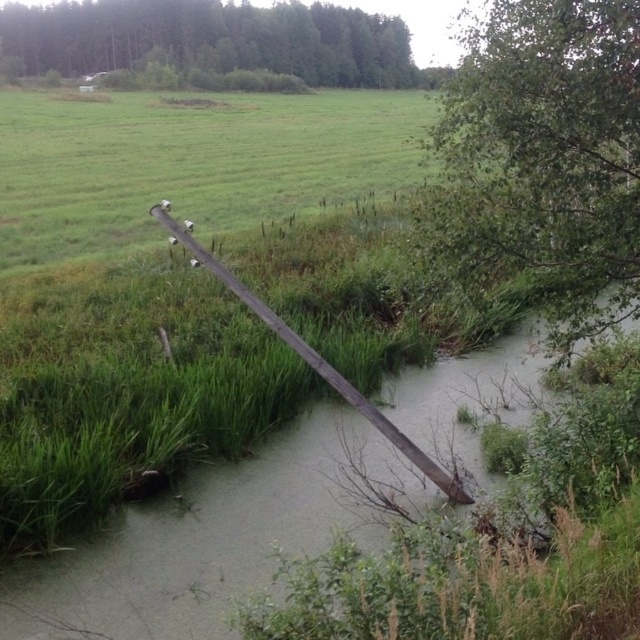
Which of these two, green leafy tree at lower right or green leafy tree at upper center, stands shorter?

Standing shorter between the two is green leafy tree at lower right.

Is point (609, 308) closer to viewer compared to point (426, 74)?

That is True.

Does point (493, 227) come closer to viewer compared to point (401, 56)?

Yes.

At what (x,y) coordinates should I click in order to perform the action: click on green leafy tree at lower right. Please return your answer as a coordinate pair (x, y). This screenshot has height=640, width=640. Looking at the image, I should click on (545, 157).

Is green leafy tree at lower right to the right of wooden pole at center from the viewer's perspective?

Correct, you'll find green leafy tree at lower right to the right of wooden pole at center.

Does green leafy tree at lower right appear on the left side of wooden pole at center?

Incorrect, green leafy tree at lower right is not on the left side of wooden pole at center.

Between point (472, 268) and point (196, 244), which one is positioned behind?

Positioned behind is point (196, 244).

Locate an element on the screen. The image size is (640, 640). green leafy tree at lower right is located at coordinates (545, 157).

Does green leafy tree at upper center appear over wooden pole at center?

Indeed, green leafy tree at upper center is positioned over wooden pole at center.

Can you confirm if green leafy tree at upper center is smaller than wooden pole at center?

No.

Is point (84, 68) positioned in front of point (368, 419)?

That is False.

The width and height of the screenshot is (640, 640). Find the location of `green leafy tree at upper center`. green leafy tree at upper center is located at coordinates (216, 38).